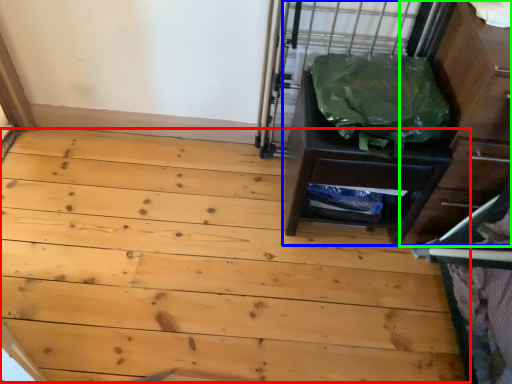
Question: Based on their relative distances, which object is farther from plywood (highlighted by a red box)? Choose from chest of drawers (highlighted by a blue box) and dresser (highlighted by a green box).

Choices:
 (A) chest of drawers
 (B) dresser

Answer: (B)